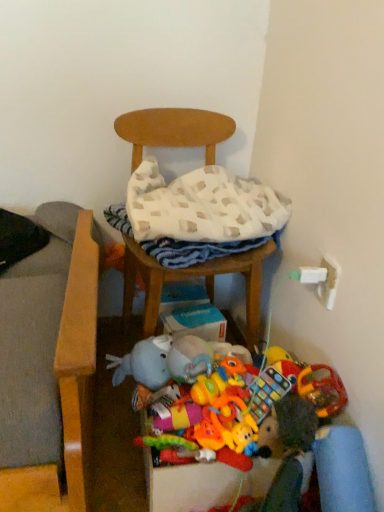
The width and height of the screenshot is (384, 512). What do you see at coordinates (191, 278) in the screenshot?
I see `wooden chair at center` at bounding box center [191, 278].

Locate an element on the screen. Image resolution: width=384 pixels, height=512 pixels. wooden chair at center is located at coordinates (191, 278).

This screenshot has height=512, width=384. What do you see at coordinates (197, 214) in the screenshot?
I see `white woven blanket at center` at bounding box center [197, 214].

I want to click on rubberized plastic toy at lower center, the 2th toy in the left-to-right sequence, so click(267, 392).

Is point (176, 226) positioned in front of point (142, 115)?

Yes, it is.

Based on the photo, which is behind, white woven blanket at center or wooden chair at center?

Positioned behind is white woven blanket at center.

I want to click on chair on the left of white woven blanket at center, so click(x=191, y=278).

Is wooden chair at center wider or thinner than rubberized plastic toy at lower center, the 2th toy in the left-to-right sequence?

wooden chair at center is wider than rubberized plastic toy at lower center, the 2th toy in the left-to-right sequence.

From a real-world perspective, is wooden chair at center physically located above or below rubberized plastic toy at lower center, the 2th toy in the left-to-right sequence?

From a real-world perspective, wooden chair at center is physically above rubberized plastic toy at lower center, the 2th toy in the left-to-right sequence.

Would you consider wooden chair at center to be distant from rubberized plastic toy at lower center, which ranks as the 1th toy in right-to-left order?

Actually, wooden chair at center and rubberized plastic toy at lower center, which ranks as the 1th toy in right-to-left order, are a little close together.

Based on the photo, can you confirm if wooden chair at center is thinner than white woven blanket at center?

No, wooden chair at center is not thinner than white woven blanket at center.

Which is in front, wooden chair at center or white woven blanket at center?

wooden chair at center.

Locate an element on the screen. This screenshot has width=384, height=512. blanket that appears above the wooden chair at center (from the image's perspective) is located at coordinates (197, 214).

Is point (180, 144) positioned after point (193, 223)?

Yes, it is behind point (193, 223).

Does knitted fabric rattle at center, which is the first toy in left-to-right order, contain wooden chair at center?

Definitely not — wooden chair at center is not inside knitted fabric rattle at center, which is the first toy in left-to-right order.

What's the angular difference between knitted fabric rattle at center, which is the first toy in left-to-right order, and wooden chair at center's facing directions?

9.79 degrees.

From a real-world perspective, is knitted fabric rattle at center, which is the first toy in left-to-right order, beneath wooden chair at center?

Correct, in the physical world, knitted fabric rattle at center, which is the first toy in left-to-right order, is lower than wooden chair at center.

Considering the relative sizes of knitted fabric rattle at center, which is counted as the second toy, starting from the right, and wooden chair at center in the image provided, is knitted fabric rattle at center, which is counted as the second toy, starting from the right, bigger than wooden chair at center?

No, knitted fabric rattle at center, which is counted as the second toy, starting from the right, is not bigger than wooden chair at center.

The image size is (384, 512). Identify the location of toy on the right of knitted fabric rattle at center, which is the first toy in left-to-right order. (267, 392).

From a real-world perspective, is knitted fabric rattle at center, which is counted as the second toy, starting from the right, above or below rubberized plastic toy at lower center, which ranks as the 1th toy in right-to-left order?

In terms of real-world spatial position, knitted fabric rattle at center, which is counted as the second toy, starting from the right, is below rubberized plastic toy at lower center, which ranks as the 1th toy in right-to-left order.

Choose the correct answer: Is knitted fabric rattle at center, which is counted as the second toy, starting from the right, inside rubberized plastic toy at lower center, which ranks as the 1th toy in right-to-left order, or outside it?

knitted fabric rattle at center, which is counted as the second toy, starting from the right, cannot be found inside rubberized plastic toy at lower center, which ranks as the 1th toy in right-to-left order.

Is knitted fabric rattle at center, which is counted as the second toy, starting from the right, oriented towards rubberized plastic toy at lower center, the 2th toy in the left-to-right sequence?

No, knitted fabric rattle at center, which is counted as the second toy, starting from the right, is not facing towards rubberized plastic toy at lower center, the 2th toy in the left-to-right sequence.

Would you say rubberized plastic toy at lower center, the 2th toy in the left-to-right sequence, contains wooden chair at center?

No.

Based on the photo, can you confirm if rubberized plastic toy at lower center, which ranks as the 1th toy in right-to-left order, is shorter than wooden chair at center?

Yes.

Between rubberized plastic toy at lower center, which ranks as the 1th toy in right-to-left order, and wooden chair at center, which one is positioned behind?

wooden chair at center is more distant.

Is rubberized plastic toy at lower center, the 2th toy in the left-to-right sequence, facing towards wooden chair at center?

No, rubberized plastic toy at lower center, the 2th toy in the left-to-right sequence, is not aimed at wooden chair at center.

Considering the positions of objects knitted fabric rattle at center, which is counted as the second toy, starting from the right, and white woven blanket at center in the image provided, who is in front, knitted fabric rattle at center, which is counted as the second toy, starting from the right, or white woven blanket at center?

knitted fabric rattle at center, which is counted as the second toy, starting from the right, is in front.

Between knitted fabric rattle at center, which is counted as the second toy, starting from the right, and white woven blanket at center, which one appears on the right side from the viewer's perspective?

white woven blanket at center.

Locate an element on the screen. This screenshot has height=512, width=384. blanket above the knitted fabric rattle at center, which is counted as the second toy, starting from the right (from the image's perspective) is located at coordinates (197, 214).

Are knitted fabric rattle at center, which is counted as the second toy, starting from the right, and white woven blanket at center located far from each other?

No, there isn't a large distance between knitted fabric rattle at center, which is counted as the second toy, starting from the right, and white woven blanket at center.

This screenshot has width=384, height=512. I want to click on blanket behind the wooden chair at center, so click(197, 214).

Locate an element on the screen. This screenshot has width=384, height=512. chair above the rubberized plastic toy at lower center, the 2th toy in the left-to-right sequence (from a real-world perspective) is located at coordinates (191, 278).

When comparing their distances from wooden chair at center, does white woven blanket at center or rubberized plastic toy at lower center, the 2th toy in the left-to-right sequence, seem closer?

Among the two, white woven blanket at center is located nearer to wooden chair at center.

When comparing their distances from rubberized plastic toy at lower center, the 2th toy in the left-to-right sequence, does knitted fabric rattle at center, which is counted as the second toy, starting from the right, or white woven blanket at center seem closer?

The object closer to rubberized plastic toy at lower center, the 2th toy in the left-to-right sequence, is knitted fabric rattle at center, which is counted as the second toy, starting from the right.

Estimate the real-world distances between objects in this image. Which object is closer to knitted fabric rattle at center, which is the first toy in left-to-right order, wooden chair at center or white woven blanket at center?

wooden chair at center lies closer to knitted fabric rattle at center, which is the first toy in left-to-right order, than the other object.

From the image, which object appears to be farther from white woven blanket at center, wooden chair at center or rubberized plastic toy at lower center, which ranks as the 1th toy in right-to-left order?

Based on the image, rubberized plastic toy at lower center, which ranks as the 1th toy in right-to-left order, appears to be further to white woven blanket at center.

Based on the photo, when comparing their distances from knitted fabric rattle at center, which is counted as the second toy, starting from the right, does rubberized plastic toy at lower center, which ranks as the 1th toy in right-to-left order, or wooden chair at center seem closer?

Based on the image, rubberized plastic toy at lower center, which ranks as the 1th toy in right-to-left order, appears to be nearer to knitted fabric rattle at center, which is counted as the second toy, starting from the right.

Looking at the image, which one is located closer to wooden chair at center, knitted fabric rattle at center, which is counted as the second toy, starting from the right, or white woven blanket at center?

white woven blanket at center.

Which object lies nearer to the anchor point white woven blanket at center, rubberized plastic toy at lower center, the 2th toy in the left-to-right sequence, or knitted fabric rattle at center, which is counted as the second toy, starting from the right?

rubberized plastic toy at lower center, the 2th toy in the left-to-right sequence.

In the scene shown: Based on their spatial positions, is white woven blanket at center or rubberized plastic toy at lower center, which ranks as the 1th toy in right-to-left order, further from knitted fabric rattle at center, which is counted as the second toy, starting from the right?

Based on the image, white woven blanket at center appears to be further to knitted fabric rattle at center, which is counted as the second toy, starting from the right.

At what (x,y) coordinates should I click in order to perform the action: click on toy between wooden chair at center and knitted fabric rattle at center, which is the first toy in left-to-right order, from top to bottom. Please return your answer as a coordinate pair (x, y). The width and height of the screenshot is (384, 512). Looking at the image, I should click on (267, 392).

At what (x,y) coordinates should I click in order to perform the action: click on chair between white woven blanket at center and rubberized plastic toy at lower center, the 2th toy in the left-to-right sequence, in the up-down direction. Please return your answer as a coordinate pair (x, y). This screenshot has height=512, width=384. Looking at the image, I should click on (191, 278).

Locate an element on the screen. The width and height of the screenshot is (384, 512). toy that lies between white woven blanket at center and knitted fabric rattle at center, which is the first toy in left-to-right order, from top to bottom is located at coordinates (267, 392).

This screenshot has height=512, width=384. I want to click on chair between white woven blanket at center and knitted fabric rattle at center, which is the first toy in left-to-right order, from top to bottom, so click(191, 278).